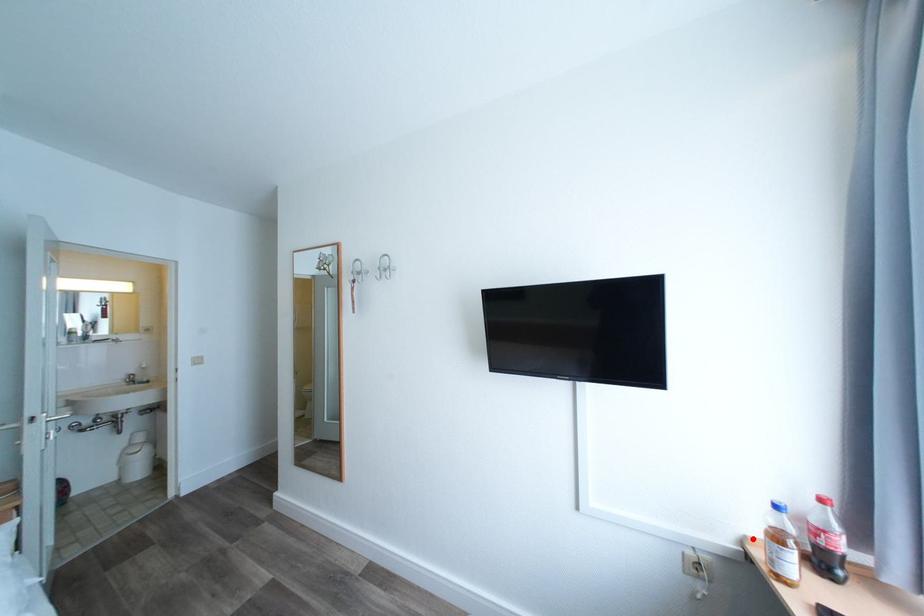
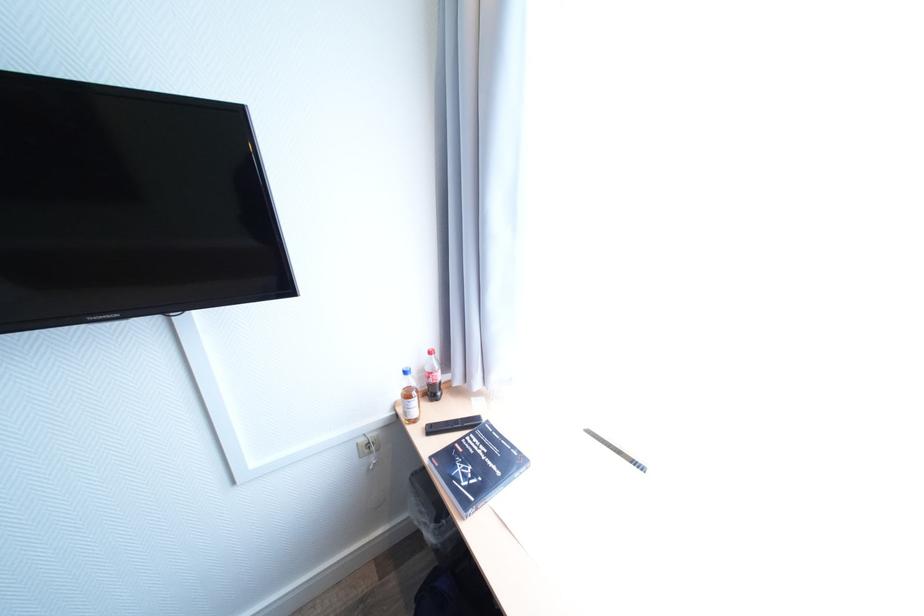
Find the pixel in the second image that matches the highlighted location in the first image.

(403, 403)